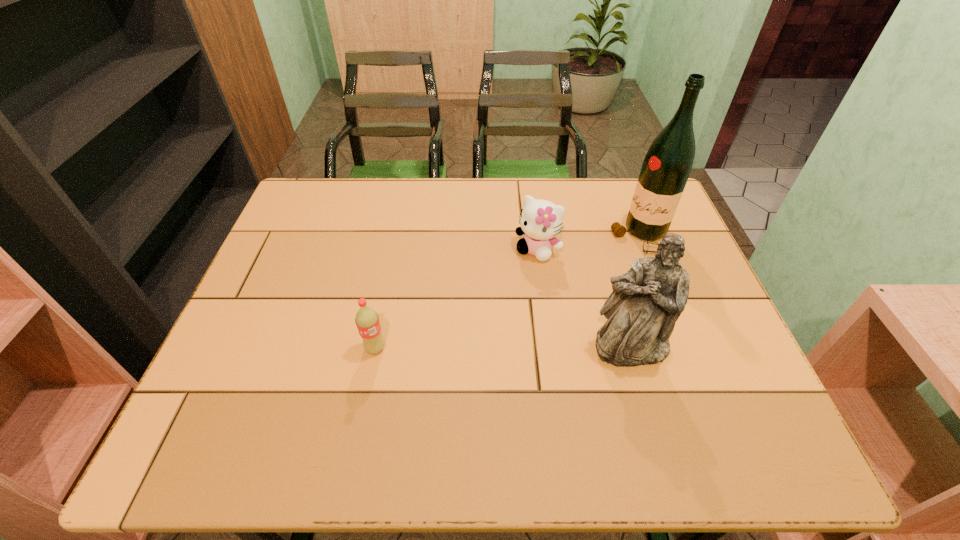
You are a GUI agent. You are given a task and a screenshot of the screen. Output one action in this format:
    pyautogui.click(x=<x>, y=<y>)
    Task: Click on the free space on the desktop that is between the soda and the figurine and is positioned on the front-facing side of the second object from left to right
    Image resolution: width=960 pixels, height=540 pixels.
    Given the screenshot: What is the action you would take?
    coord(468,348)

Locate an element on the screen. The image size is (960, 540). free space on the desktop that is between the leftmost object and the second tallest object and is positioned on the surface of the tallest object is located at coordinates (518, 348).